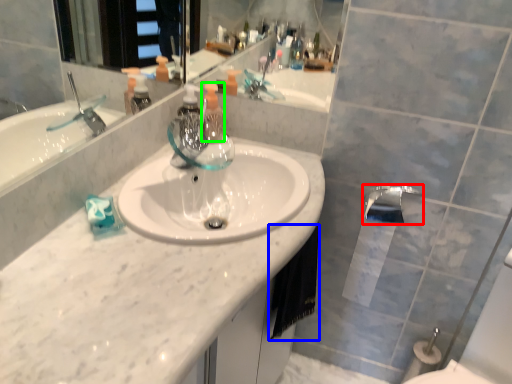
Question: Estimate the real-world distances between objects in this image. Which object is closer to tap (highlighted by a red box), hand towel (highlighted by a blue box) or soap dispenser (highlighted by a green box)?

Choices:
 (A) hand towel
 (B) soap dispenser

Answer: (A)